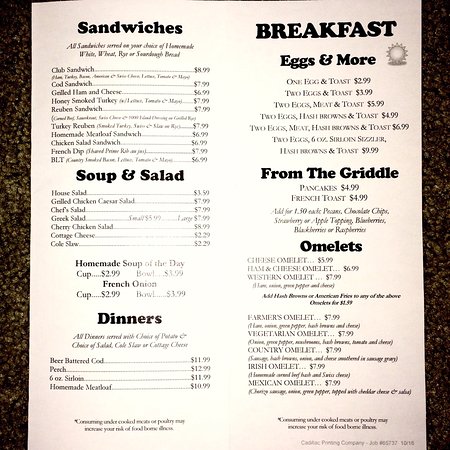
I want to click on table, so click(7, 211).